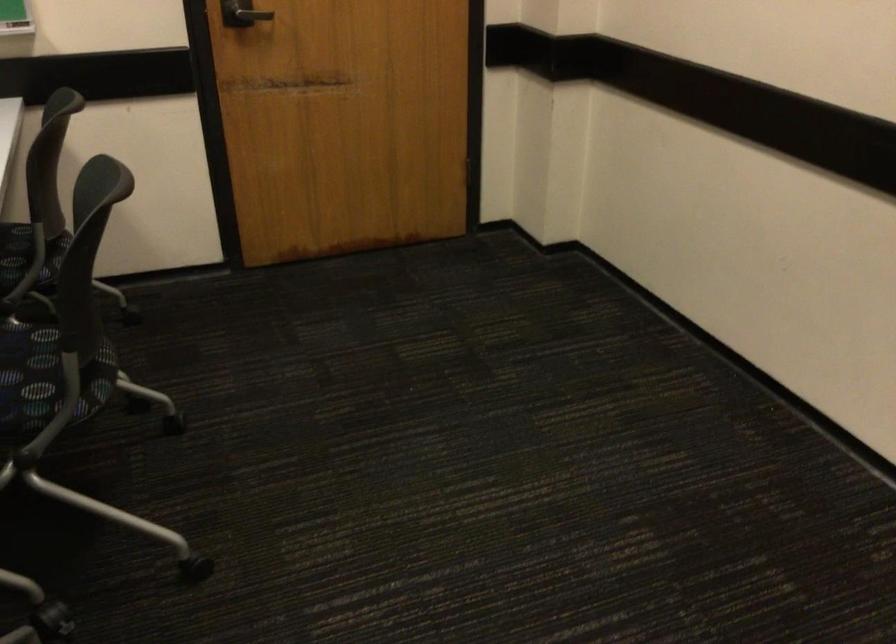
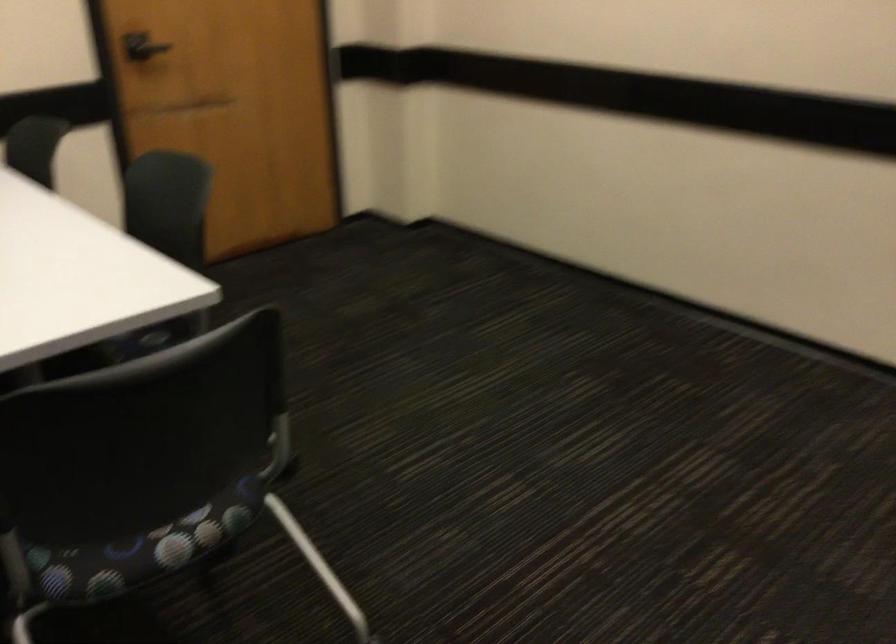
Based on the photo, the images are taken continuously from a first-person perspective. In which direction are you moving?

The cameraman moved toward left, backward.